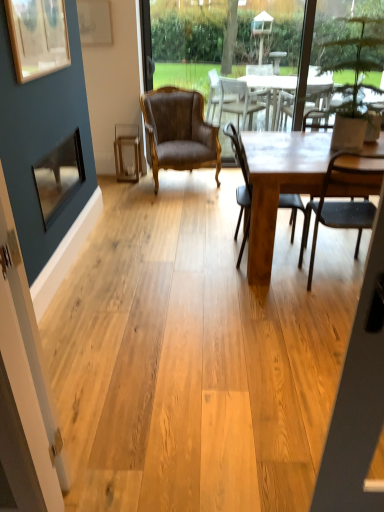
Question: Considering the relative sizes of transparent glass screen door at left and wooden picture frame at upper left, the third picture frame in the back-to-front sequence, in the image provided, is transparent glass screen door at left bigger than wooden picture frame at upper left, the third picture frame in the back-to-front sequence,?

Choices:
 (A) yes
 (B) no

Answer: (B)

Question: Does transparent glass screen door at left come in front of wooden picture frame at upper left, which appears as the 1th picture frame when viewed from the front?

Choices:
 (A) no
 (B) yes

Answer: (B)

Question: Does transparent glass screen door at left turn towards wooden picture frame at upper left, the third picture frame in the back-to-front sequence?

Choices:
 (A) no
 (B) yes

Answer: (A)

Question: Is transparent glass screen door at left placed right next to wooden picture frame at upper left, which ranks as the second picture frame in top-to-bottom order?

Choices:
 (A) yes
 (B) no

Answer: (B)

Question: Does transparent glass screen door at left come behind wooden picture frame at upper left, which appears as the 1th picture frame when viewed from the front?

Choices:
 (A) yes
 (B) no

Answer: (B)

Question: Is transparent glass screen door at left far from wooden picture frame at upper left, which ranks as the second picture frame in top-to-bottom order?

Choices:
 (A) no
 (B) yes

Answer: (B)

Question: Is wooden table at center far away from matte brown chair at center, placed as the 2th chair when sorted from front to back?

Choices:
 (A) yes
 (B) no

Answer: (B)

Question: Does wooden table at center have a smaller size compared to matte brown chair at center, the second chair viewed from the left?

Choices:
 (A) yes
 (B) no

Answer: (B)

Question: Can you confirm if wooden table at center is thinner than matte brown chair at center, the second chair in the back-to-front sequence?

Choices:
 (A) no
 (B) yes

Answer: (A)

Question: Is wooden table at center facing towards matte brown chair at center, the second chair viewed from the left?

Choices:
 (A) yes
 (B) no

Answer: (B)

Question: Is wooden table at center positioned before matte brown chair at center, which is the 2th chair from right to left?

Choices:
 (A) no
 (B) yes

Answer: (B)

Question: Is wooden table at center bigger than matte brown chair at center, the second chair in the back-to-front sequence?

Choices:
 (A) yes
 (B) no

Answer: (A)

Question: Is the position of brown leather armchair at center, acting as the first chair starting from the back, less distant than that of wooden table at center?

Choices:
 (A) yes
 (B) no

Answer: (B)